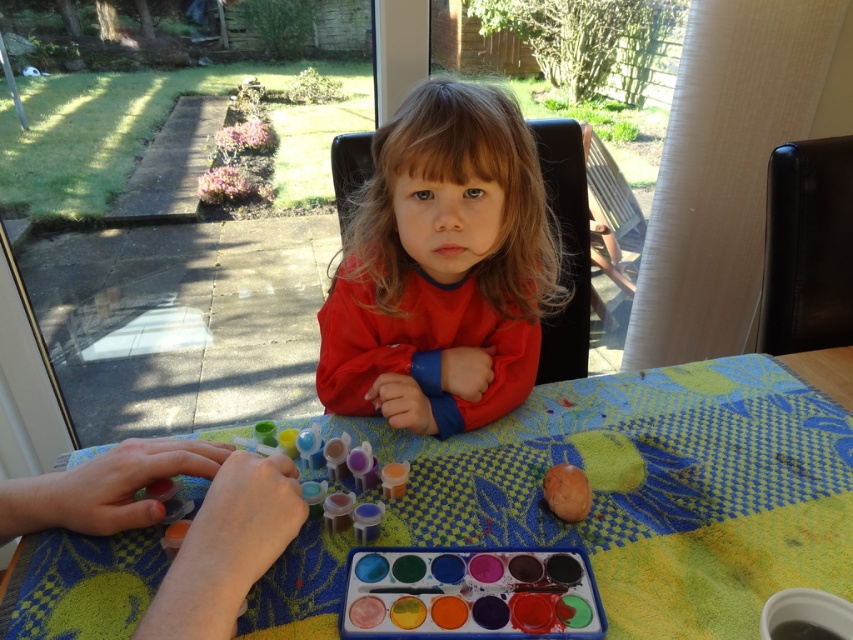
You are a parent trying to ensure your child doesn not get paint on their hair. The red matte hair at center and watercolor paint palette at center are both at the center of the table. Are they close enough that paint could easily splash from the palette onto the hair?

The red matte hair at center and watercolor paint palette at center are 11.92 inches apart from each other. Since this distance is relatively close, there is a possibility that paint could splash from the palette onto the hair.

You are a child sitting at the table in the image. You want to reach the point at the front of the table to grab a paintbrush. Which point should you reach for, point at (381, 531) or point at (376, 134)?

You should reach for point at (381, 531) because it is in front of point at (376, 134).